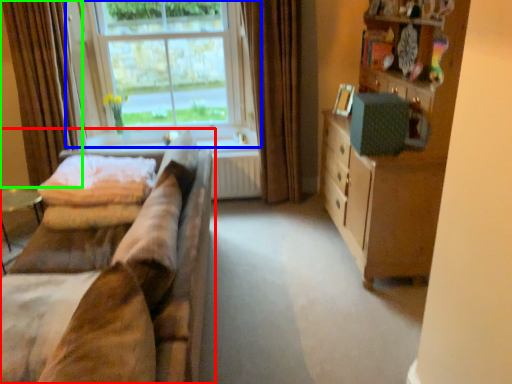
Question: Which object is the farthest from studio couch (highlighted by a red box)? Choose among these: window (highlighted by a blue box) or curtain (highlighted by a green box).

Choices:
 (A) window
 (B) curtain

Answer: (B)